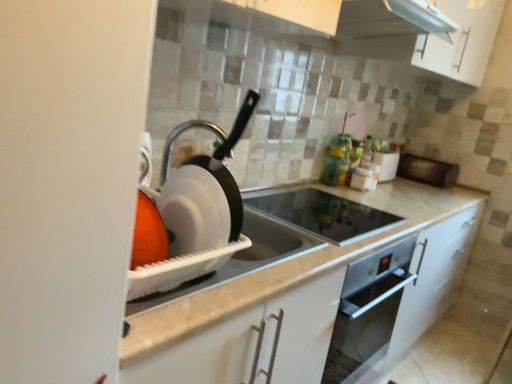
Where is `empty space that is to the right of white glossy toaster at upper right, the 2th appliance viewed from the back`? The image size is (512, 384). empty space that is to the right of white glossy toaster at upper right, the 2th appliance viewed from the back is located at coordinates (407, 182).